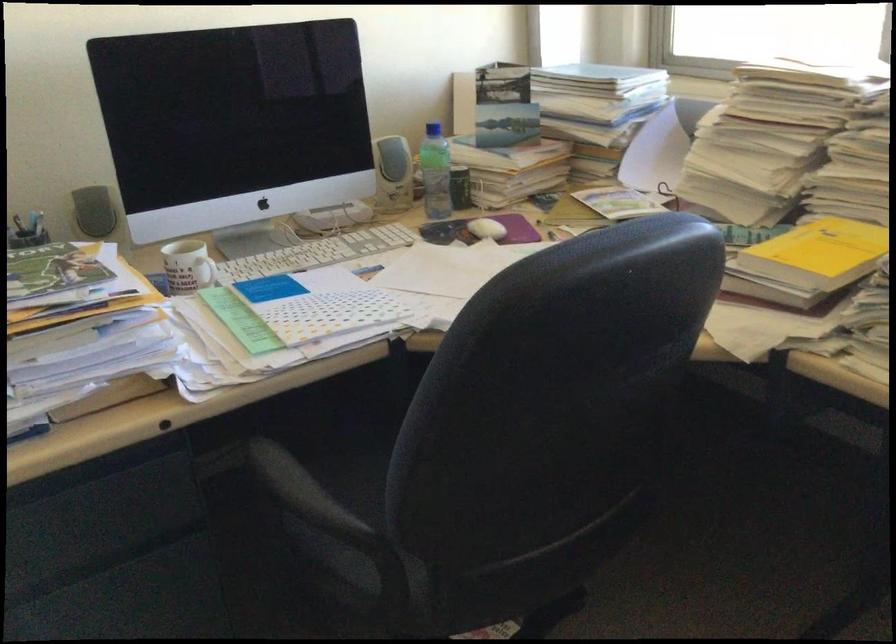
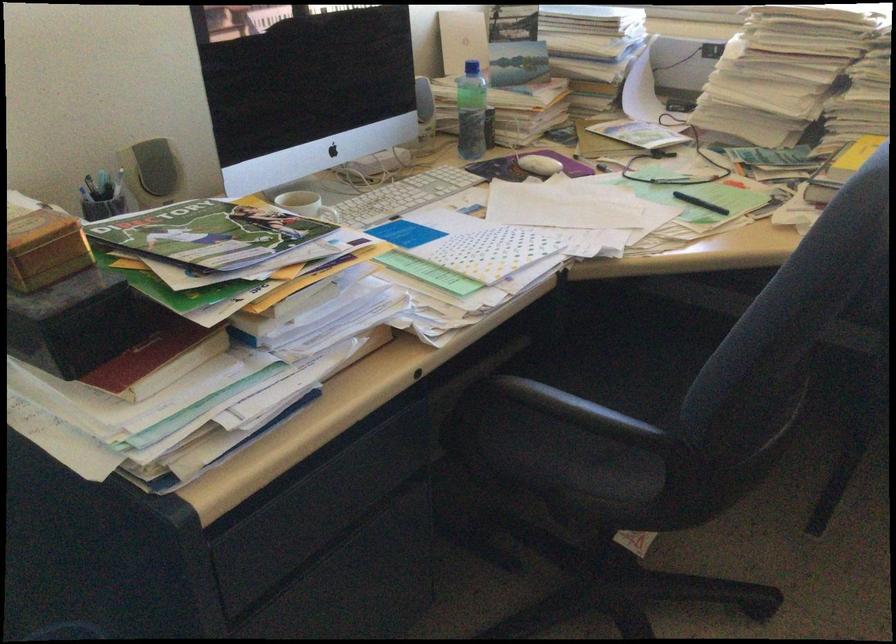
Find the pixel in the second image that matches point 433,129 in the first image.

(478, 69)